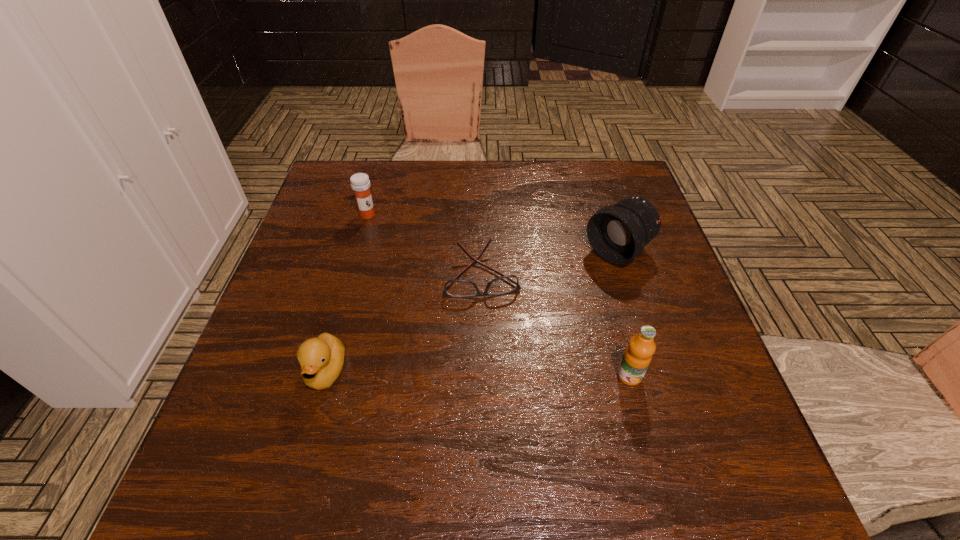
You are a GUI agent. You are given a task and a screenshot of the screen. Output one action in this format:
    pyautogui.click(x=<x>, y=<y>)
    Task: Click on the free space on the desktop that is between the duckling and the orange juice and is positioned on the label side of the farthest object
    The image size is (960, 540).
    Given the screenshot: What is the action you would take?
    pyautogui.click(x=501, y=374)

Locate an element on the screen. The image size is (960, 540). vacant space on the desktop that is between the duckling and the orange juice and is positioned on the front-facing side of the third object from left to right is located at coordinates (496, 374).

The height and width of the screenshot is (540, 960). I want to click on free spot on the desktop that is between the duckling and the orange juice and is positioned at the front element of the telephoto lens, so click(457, 374).